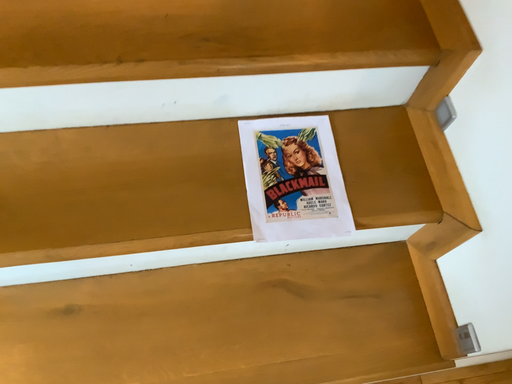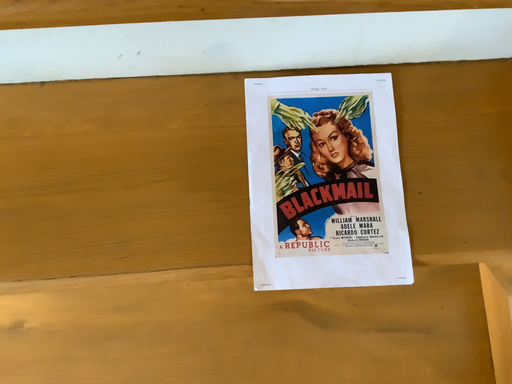
Question: How did the camera likely rotate when shooting the video?

Choices:
 (A) rotated upward
 (B) rotated downward

Answer: (B)